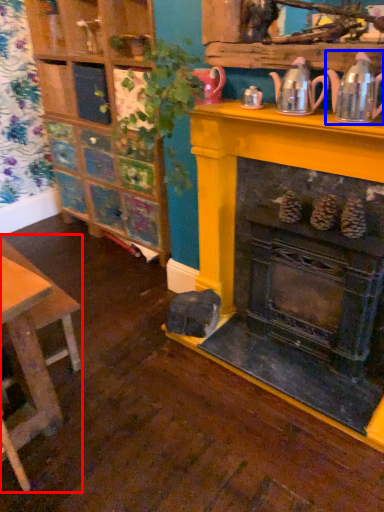
Question: Which point is closer to the camera, table (highlighted by a red box) or tea pot (highlighted by a blue box)?

Choices:
 (A) table
 (B) tea pot

Answer: (B)